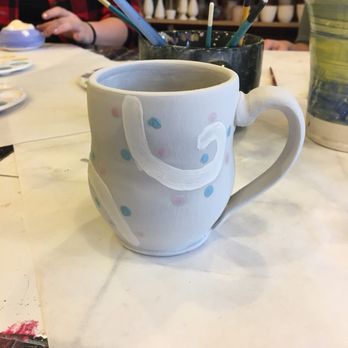
The height and width of the screenshot is (348, 348). What are the coordinates of `cup handle` in the screenshot? It's located at (293, 125).